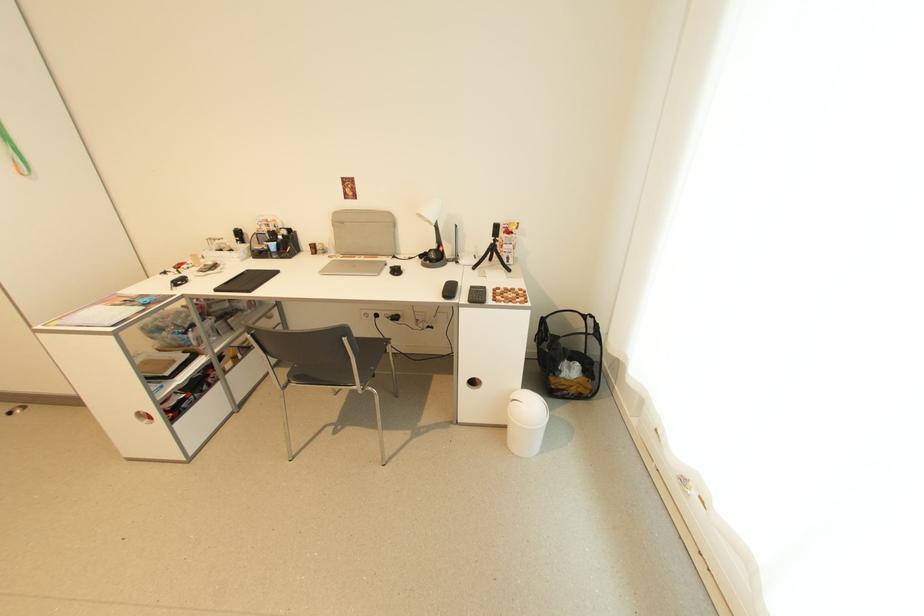
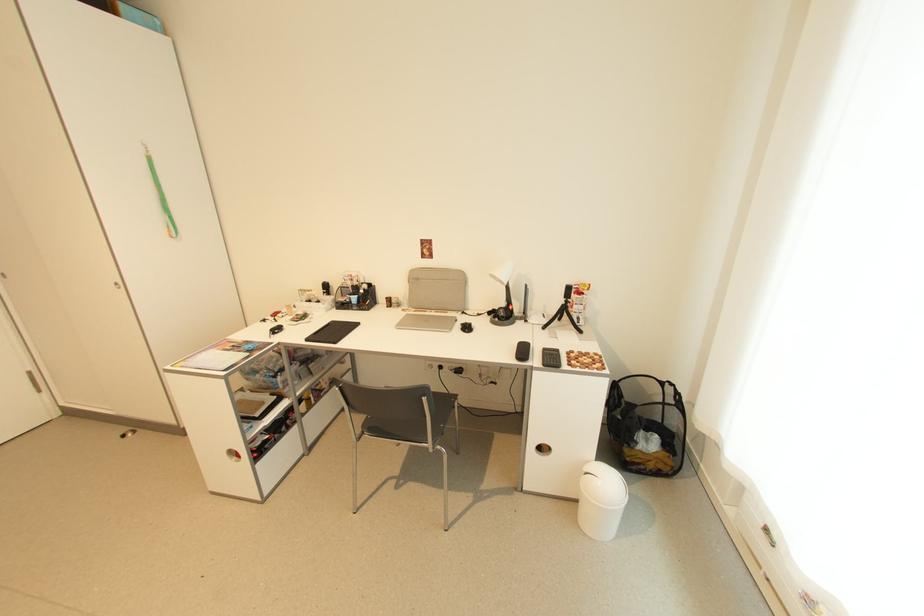
The point at [500,241] is marked in the first image. Where is the corresponding point in the second image?

(572, 302)